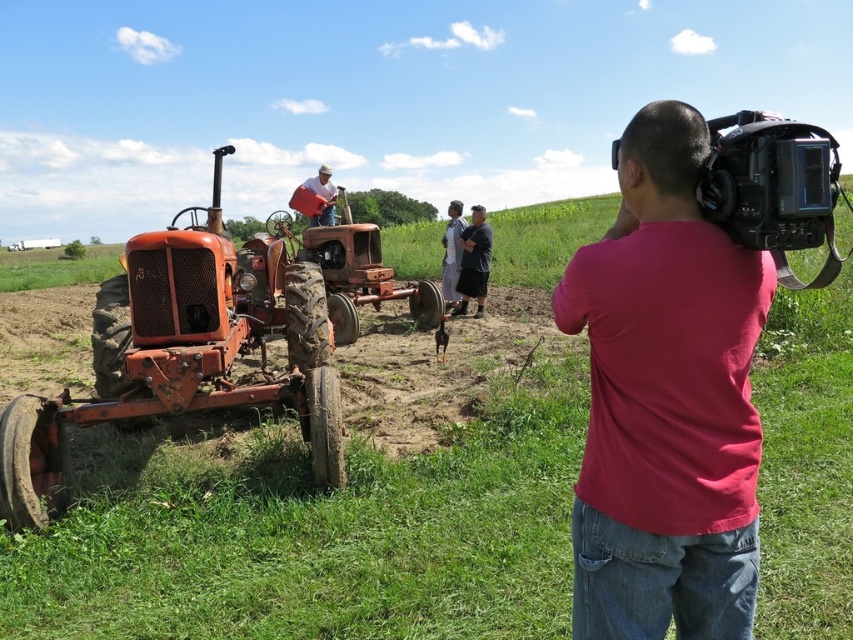
You are standing at the point with coordinates (183, 353) in the image. What object are you standing on?

You are standing on the rusty metal tractor at left.

You are a photographer trying to capture both the rusty metal tractor at left and the matte orange tractor at center in a single frame. Given their sizes, which tractor should you position closer to the camera to ensure both appear roughly the same size in the photo?

Since the rusty metal tractor at left is bigger than the matte orange tractor at center, you should position the smaller matte orange tractor at center closer to the camera. This way, the larger rusty metal tractor at left can be placed farther back, balancing their apparent sizes in the photo.

You are a farmer who needs to move a 5.5 meter long bale of hay between the rusty metal tractor at left and the matte orange tractor at center. Can you fit the bale of hay between them without touching either tractor?

The rusty metal tractor at left and the matte orange tractor at center are 6.30 meters apart. Since the bale of hay is 5.5 meters long, it can fit between them with 0.8 meters of space remaining. Therefore, the bale of hay can be placed between them without touching either tractor.